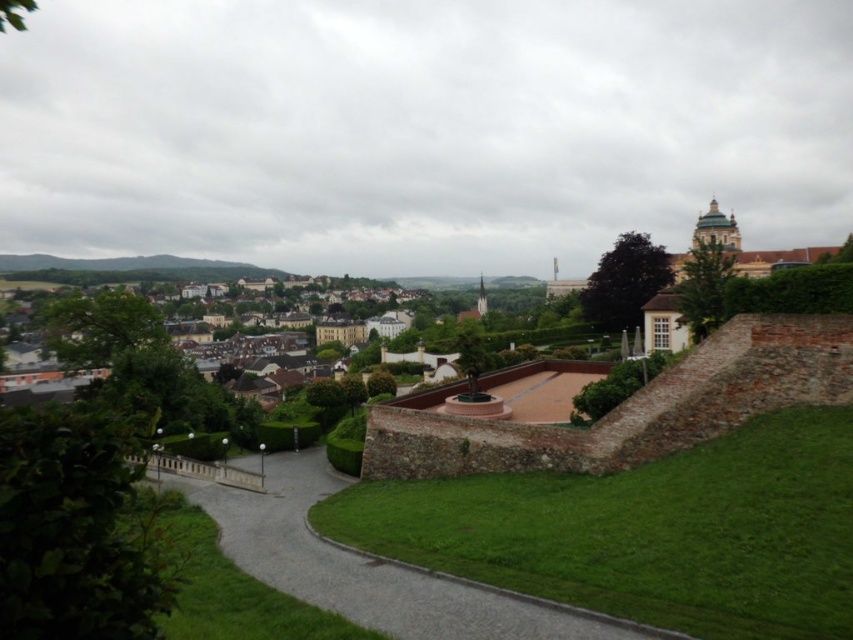
You are standing at the top of the hill and see the paved stone path at lower center and the brown stone buildings at center. Which object is located to the right side of the other?

The paved stone path at lower center is to the right of brown stone buildings at center.

You are a hiker standing at the top of the slope looking down at the paved stone path at lower center and the brown stone buildings at center. Which object is closer to your current position?

The paved stone path at lower center is closer to your current position because it has a lesser height compared to the brown stone buildings at center.

You are standing at the top of the hill overlooking the town and want to walk down to the paved stone path at lower center. If your average walking speed is 3 feet per second, how many seconds will it take you to reach the path?

The paved stone path at lower center is 77.76 feet away from the camera. At a walking speed of 3 feet per second, it would take 77.76 divided by 3 equals 25.92 seconds, so approximately 26 seconds to reach the path.